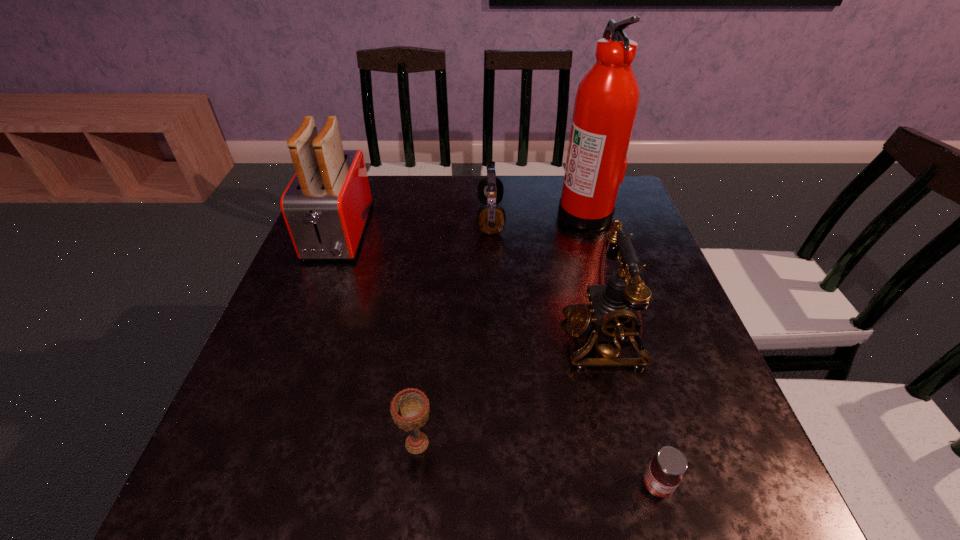
Image resolution: width=960 pixels, height=540 pixels. Identify the location of object at the far left corner. (326, 205).

I want to click on object present at the far right corner, so click(x=607, y=99).

Locate an element on the screen. object positioned at the near right corner is located at coordinates (663, 475).

The width and height of the screenshot is (960, 540). In order to click on free space at the far edge in this screenshot , I will do `click(517, 214)`.

Find the location of a particular element. Image resolution: width=960 pixels, height=540 pixels. vacant space at the near edge is located at coordinates (548, 491).

Where is `free space at the left edge of the desktop`? The image size is (960, 540). free space at the left edge of the desktop is located at coordinates (285, 423).

At what (x,y) coordinates should I click in order to perform the action: click on vacant position at the right edge of the desktop. Please return your answer as a coordinate pair (x, y). Looking at the image, I should click on (647, 369).

The width and height of the screenshot is (960, 540). In order to click on vacant area at the near left corner of the desktop in this screenshot , I will do `click(238, 498)`.

You are a GUI agent. You are given a task and a screenshot of the screen. Output one action in this format:
    pyautogui.click(x=<x>, y=<y>)
    Task: Click on the vacant area at the near right corner of the desktop
    
    Given the screenshot: What is the action you would take?
    pyautogui.click(x=688, y=478)

Find the location of a particular element. vacant space in between the second tallest object and the fourth tallest object is located at coordinates (415, 226).